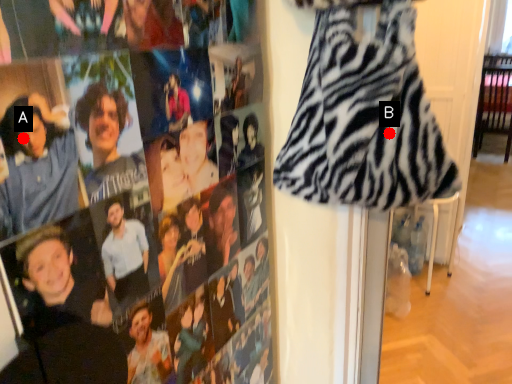
Question: Two points are circled on the image, labeled by A and B beside each circle. Among these points, which one is farthest from the camera?

Choices:
 (A) A is further
 (B) B is further

Answer: (B)